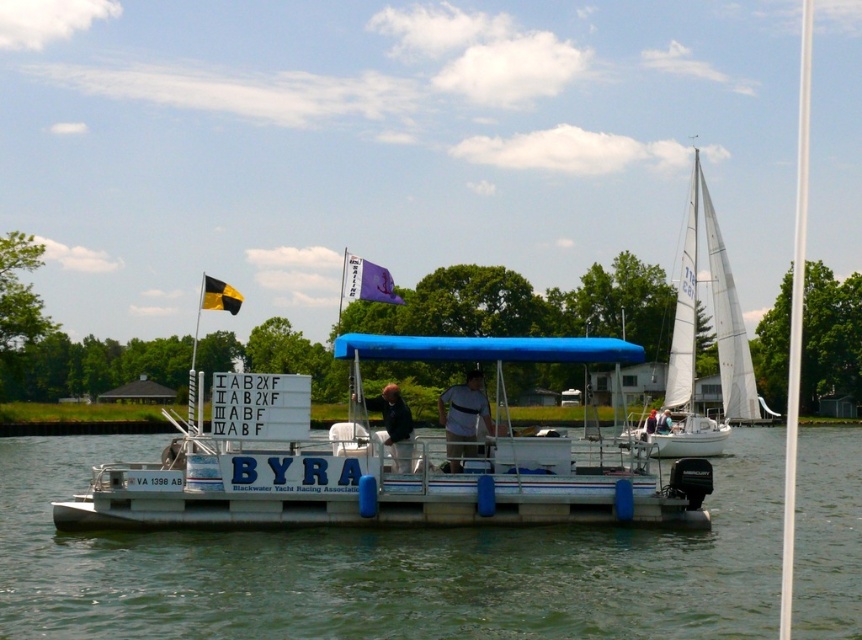
In the scene shown: You are a photographer trying to capture a clear photo of the white plastic boat at center and the light blue fabric shirt at center. Based on their sizes, which object should you focus on first to ensure it appears larger in the photo?

The white plastic boat at center has a greater height compared to the light blue fabric shirt at center, so you should focus on the white plastic boat at center first to ensure it appears larger in the photo.

What are the coordinates of the white sail at right in the image?

The white sail at right is located at coordinates point (695, 342).